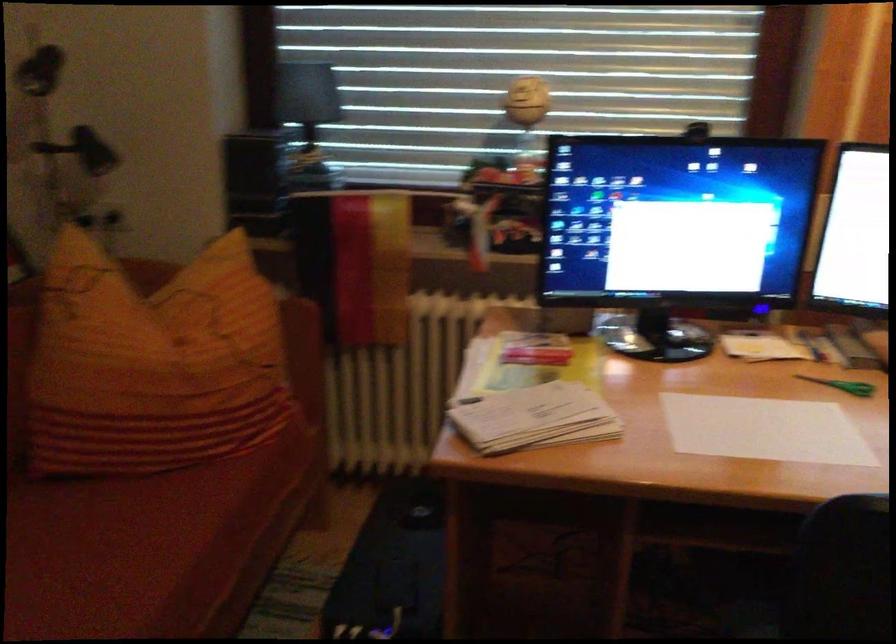
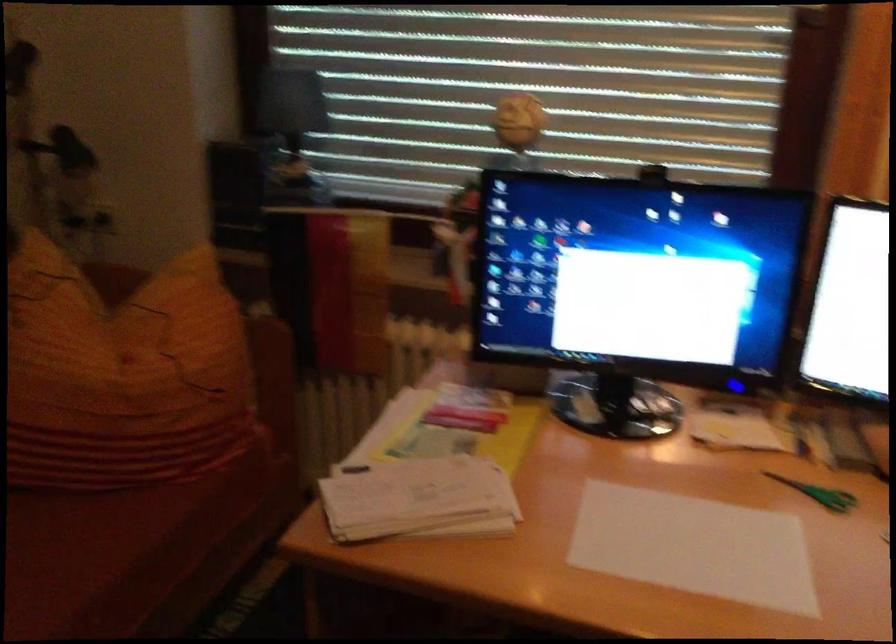
Locate, in the second image, the point that corresponds to (158,527) in the first image.

(66, 556)